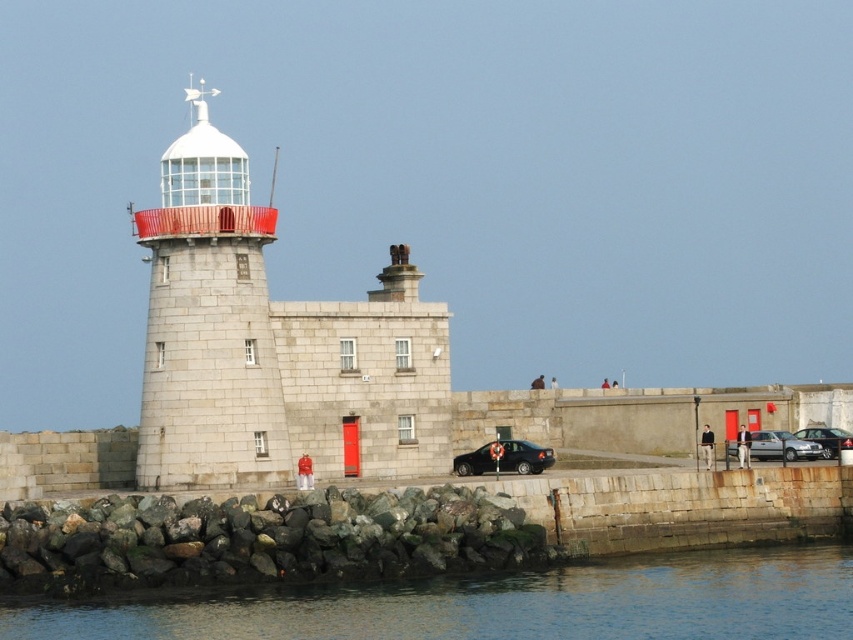
Looking at this image, you are standing at the lighthouse and looking out towards the water. There are two points marked on a map of the area. The first point is at coordinates point (184, 252) and the second is at point (772, 449). Which point is closer to you from your current position at the lighthouse?

Point (184, 252) is in front of point (772, 449), so it is closer to your current position at the lighthouse.

You are a drone operator tasked with capturing aerial footage of the lighthouse. To avoid obstacles, you need to know the position of the green mossy rock at lower center. Is it closer to the lighthouse or the edge of the rocky shore?

The green mossy rock at lower center is located at point (260, 540), which places it closer to the lighthouse than the edge of the rocky shore.

You are a photographer planning to capture the white glass lighthouse at center and the green mossy rock at lower center in a single frame. Based on their sizes, which object should you position closer to the camera to ensure both fit within the shot?

The green mossy rock at lower center might be wider than the white glass lighthouse at center, so positioning the green mossy rock at lower center closer to the camera could help balance their sizes in the frame.